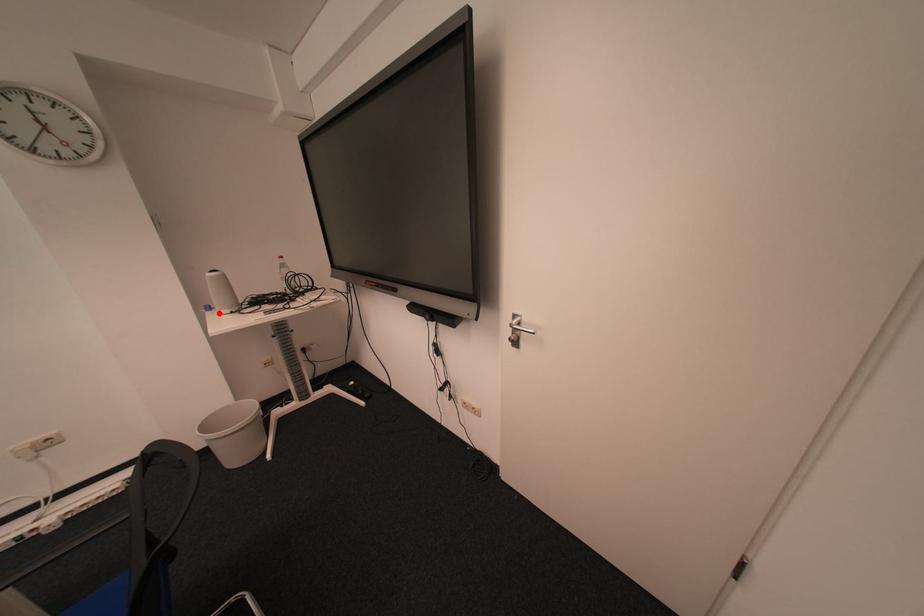
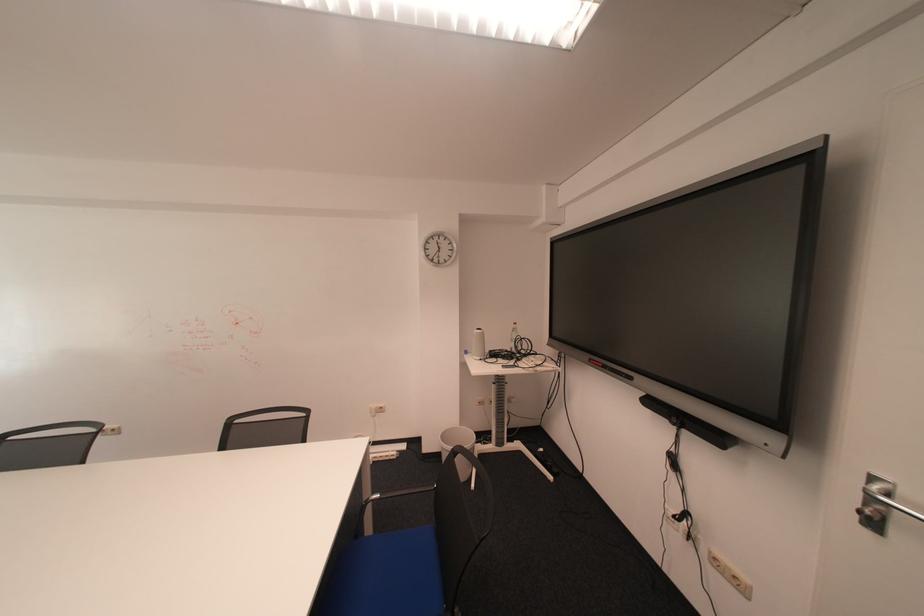
The point at the highlighted location is marked in the first image. Where is the corresponding point in the second image?

(477, 355)